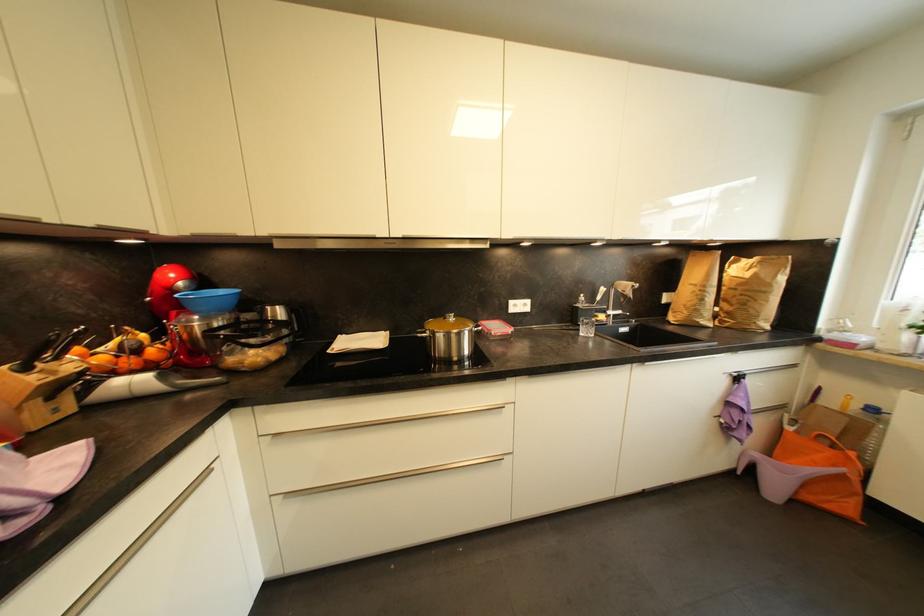
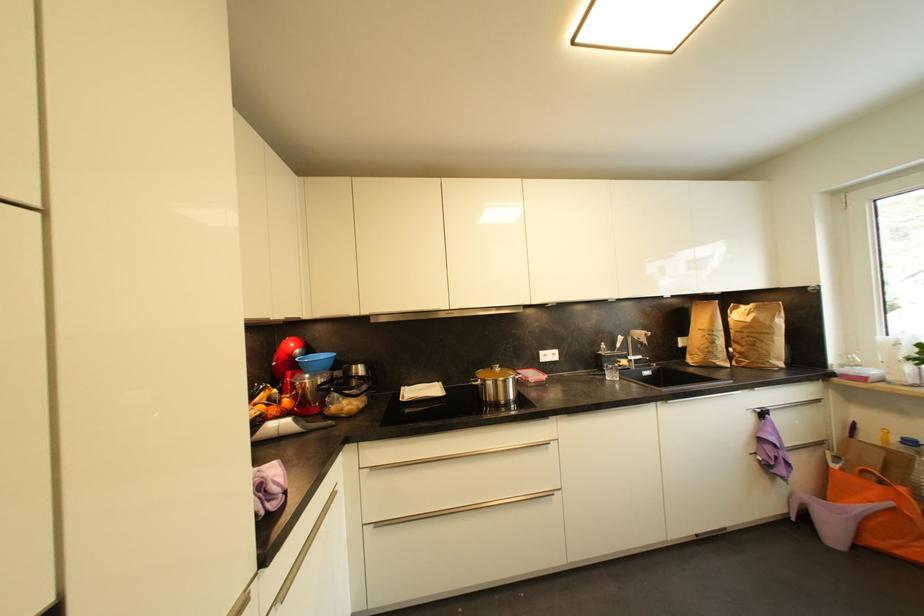
The point at (134, 363) is marked in the first image. Where is the corresponding point in the second image?

(277, 411)